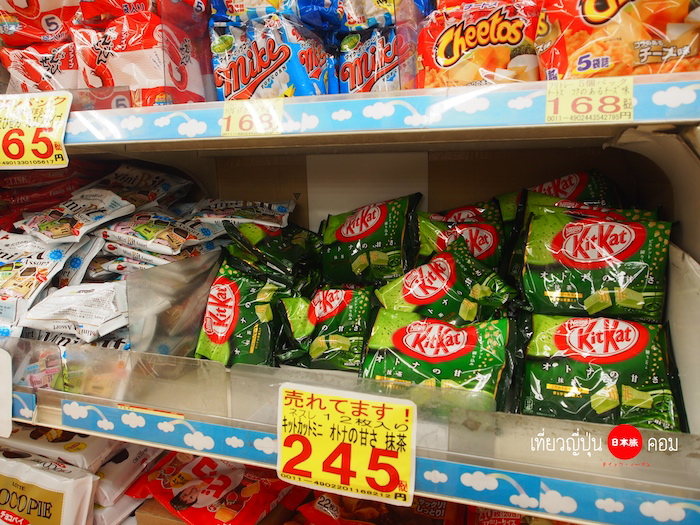
I want to click on plastic cover, so click(x=190, y=377).